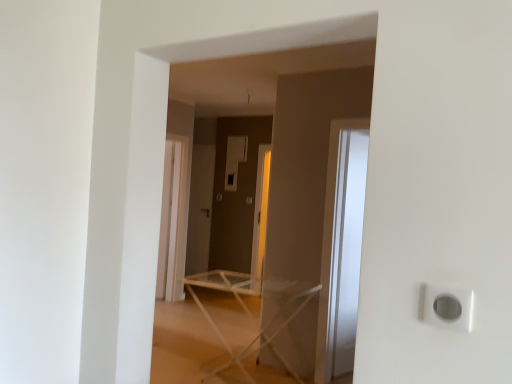
The width and height of the screenshot is (512, 384). What do you see at coordinates (250, 312) in the screenshot? I see `white plastic ironing board at center` at bounding box center [250, 312].

Where is `transparent glass door at right`? transparent glass door at right is located at coordinates (346, 250).

Does matte gray screen door at center have a lesser height compared to white plastic ironing board at center?

In fact, matte gray screen door at center may be taller than white plastic ironing board at center.

From the image's perspective, is matte gray screen door at center positioned above or below white plastic ironing board at center?

matte gray screen door at center is situated higher than white plastic ironing board at center in the image.

Locate an element on the screen. The width and height of the screenshot is (512, 384). screen door that appears above the white plastic ironing board at center (from a real-world perspective) is located at coordinates (200, 209).

Find the location of `electric outlet above the white plastic ironing board at center (from a real-world perspective)`. electric outlet above the white plastic ironing board at center (from a real-world perspective) is located at coordinates (448, 307).

Who is taller, white plastic outlet at lower right or white plastic ironing board at center?

With more height is white plastic ironing board at center.

Is white plastic outlet at lower right inside or outside of white plastic ironing board at center?

white plastic outlet at lower right exists outside the volume of white plastic ironing board at center.

Is white plastic outlet at lower right smaller than white plastic ironing board at center?

Yes, white plastic outlet at lower right is smaller than white plastic ironing board at center.

In terms of width, does matte gray screen door at center look wider or thinner when compared to transparent glass door at right?

Considering their sizes, matte gray screen door at center looks slimmer than transparent glass door at right.

Is point (213, 182) closer or farther from the camera than point (328, 318)?

Point (213, 182) appears to be farther away from the viewer than point (328, 318).

Is the depth of matte gray screen door at center less than that of transparent glass door at right?

No.

Which is more to the left, white plastic ironing board at center or white plastic outlet at lower right?

white plastic ironing board at center.

From a real-world perspective, who is located higher, white plastic ironing board at center or white plastic outlet at lower right?

white plastic outlet at lower right.

Is white plastic ironing board at center shorter than white plastic outlet at lower right?

No.

In the scene shown: Does transparent glass door at right turn towards white plastic outlet at lower right?

No, transparent glass door at right does not turn towards white plastic outlet at lower right.

Measure the distance from transparent glass door at right to white plastic outlet at lower right.

They are 8.64 feet apart.

From a real-world perspective, is transparent glass door at right positioned above or below white plastic outlet at lower right?

Clearly, from a real-world perspective, transparent glass door at right is below white plastic outlet at lower right.

Is point (337, 250) positioned after point (424, 287)?

Yes, it is.

From a real-world perspective, between white plastic ironing board at center and matte gray screen door at center, who is vertically higher?

matte gray screen door at center.

You are a GUI agent. You are given a task and a screenshot of the screen. Output one action in this format:
    pyautogui.click(x=<x>, y=<y>)
    Task: Click on the furniture below the matte gray screen door at center (from the image's perspective)
    
    Given the screenshot: What is the action you would take?
    pyautogui.click(x=250, y=312)

How far apart are white plastic ironing board at center and matte gray screen door at center?

white plastic ironing board at center and matte gray screen door at center are 3.02 meters apart.

Consider the image. Which is behind, white plastic ironing board at center or matte gray screen door at center?

Positioned behind is matte gray screen door at center.

Where is `electric outlet on the right of matte gray screen door at center`? This screenshot has width=512, height=384. electric outlet on the right of matte gray screen door at center is located at coordinates (448, 307).

From the image's perspective, who appears lower, white plastic outlet at lower right or matte gray screen door at center?

From the image's view, white plastic outlet at lower right is below.

From a real-world perspective, who is located higher, white plastic outlet at lower right or matte gray screen door at center?

From a 3D spatial view, white plastic outlet at lower right is above.

Where is `furniture located in front of the matte gray screen door at center`? The image size is (512, 384). furniture located in front of the matte gray screen door at center is located at coordinates (250, 312).

Locate an element on the screen. This screenshot has height=384, width=512. electric outlet on the right side of white plastic ironing board at center is located at coordinates (448, 307).

Estimate the real-world distances between objects in this image. Which object is further from white plastic ironing board at center, transparent glass door at right or matte gray screen door at center?

Among the two, matte gray screen door at center is located further to white plastic ironing board at center.

Considering their positions, is white plastic outlet at lower right positioned further to matte gray screen door at center than white plastic ironing board at center?

white plastic outlet at lower right is positioned further to the anchor matte gray screen door at center.

Considering their positions, is white plastic ironing board at center positioned further to white plastic outlet at lower right than transparent glass door at right?

transparent glass door at right.

Based on their spatial positions, is white plastic outlet at lower right or transparent glass door at right further from white plastic ironing board at center?

white plastic outlet at lower right is positioned further to the anchor white plastic ironing board at center.

Considering their positions, is white plastic outlet at lower right positioned further to transparent glass door at right than matte gray screen door at center?

matte gray screen door at center is positioned further to the anchor transparent glass door at right.

From the image, which object appears to be nearer to transparent glass door at right, white plastic outlet at lower right or white plastic ironing board at center?

Based on the image, white plastic ironing board at center appears to be nearer to transparent glass door at right.

Looking at the image, which one is located further to white plastic outlet at lower right, transparent glass door at right or matte gray screen door at center?

Among the two, matte gray screen door at center is located further to white plastic outlet at lower right.

Looking at the image, which one is located closer to white plastic ironing board at center, matte gray screen door at center or white plastic outlet at lower right?

white plastic outlet at lower right is positioned closer to the anchor white plastic ironing board at center.

I want to click on furniture between white plastic outlet at lower right and matte gray screen door at center along the z-axis, so click(250, 312).

Find the location of `furniture located between white plastic outlet at lower right and transparent glass door at right in the depth direction`. furniture located between white plastic outlet at lower right and transparent glass door at right in the depth direction is located at coordinates (250, 312).

This screenshot has width=512, height=384. I want to click on glass door between white plastic ironing board at center and matte gray screen door at center in the front-back direction, so click(x=346, y=250).

Find the location of `glass door located between white plastic outlet at lower right and matte gray screen door at center in the depth direction`. glass door located between white plastic outlet at lower right and matte gray screen door at center in the depth direction is located at coordinates (346, 250).